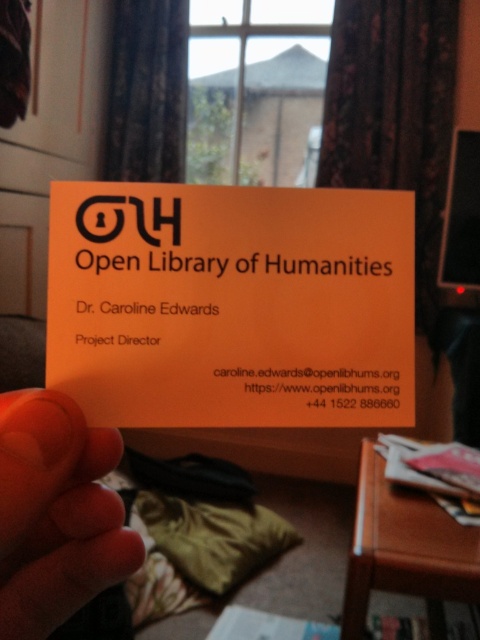
In the scene shown: Does orange matte business card at center appear on the right side of flesh-toned skin at lower left?

Yes, orange matte business card at center is to the right of flesh-toned skin at lower left.

Is point (361, 212) farther from camera compared to point (29, 419)?

That is True.

I want to click on orange matte business card at center, so click(x=231, y=305).